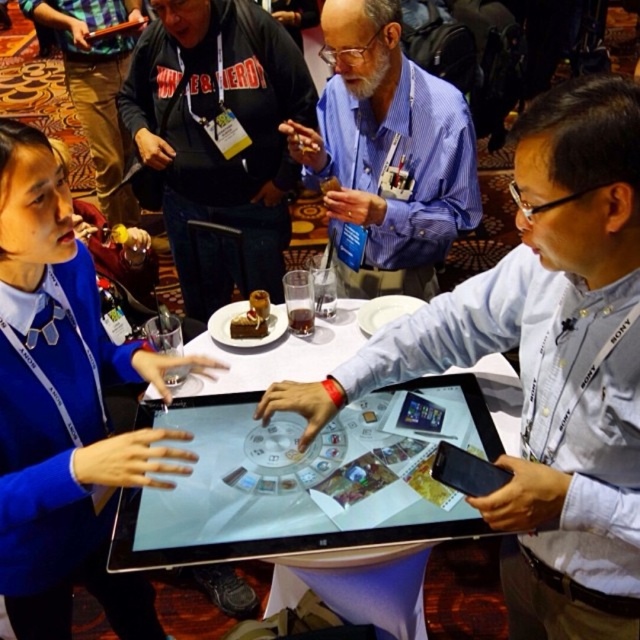
Is point (35, 595) closer to camera compared to point (390, 72)?

Yes, point (35, 595) is closer to viewer.

Which is behind, point (148, 376) or point (435, 177)?

The point (435, 177) is behind.

This screenshot has width=640, height=640. In order to click on blue fabric sweater at center in this screenshot , I will do `click(65, 410)`.

Describe the element at coordinates (545, 364) in the screenshot. The height and width of the screenshot is (640, 640). I see `white glossy tablet at center` at that location.

Consider the image. Does white glossy tablet at center appear over silver glossy tablet at center?

Yes, white glossy tablet at center is above silver glossy tablet at center.

Measure the distance between white glossy tablet at center and camera.

white glossy tablet at center is 31.56 inches from camera.

Identify the location of white glossy tablet at center. (545, 364).

Who is lower down, blue shirt at center or matte black hoodie at upper left?

blue shirt at center

This screenshot has width=640, height=640. What are the coordinates of `blue shirt at center` in the screenshot? It's located at (387, 156).